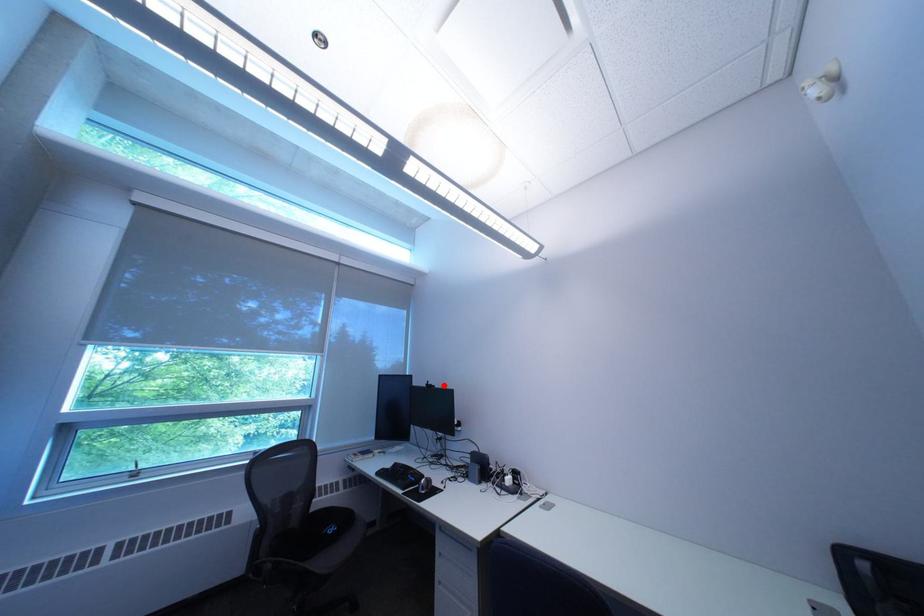
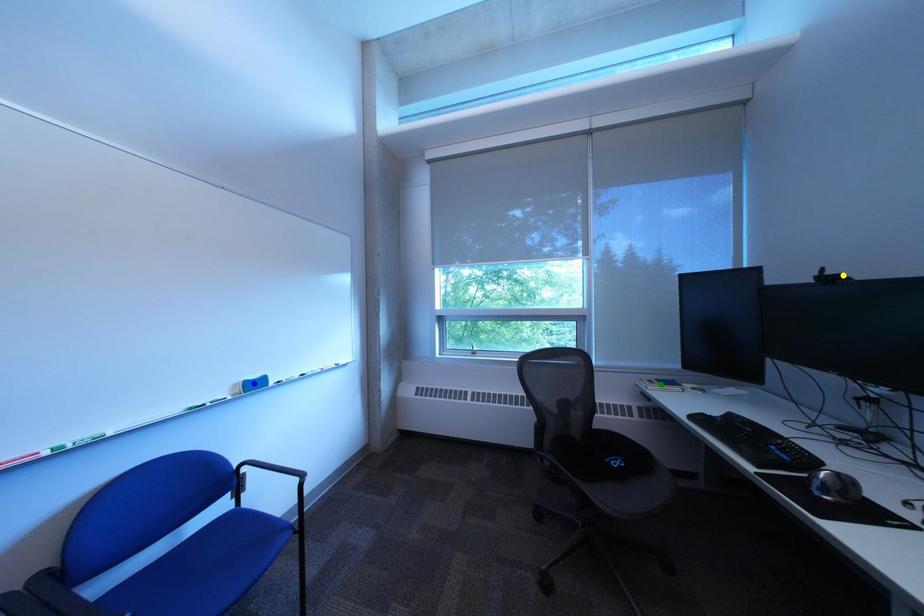
Question: I am providing you with two images of the same scene from different viewpoints. A red point is marked on the first image. You are given multiple points on the second image. Which spot in image 2 lines up with the point in image 1?

Choices:
 (A) yellow point
 (B) green point
 (C) blue point

Answer: (A)